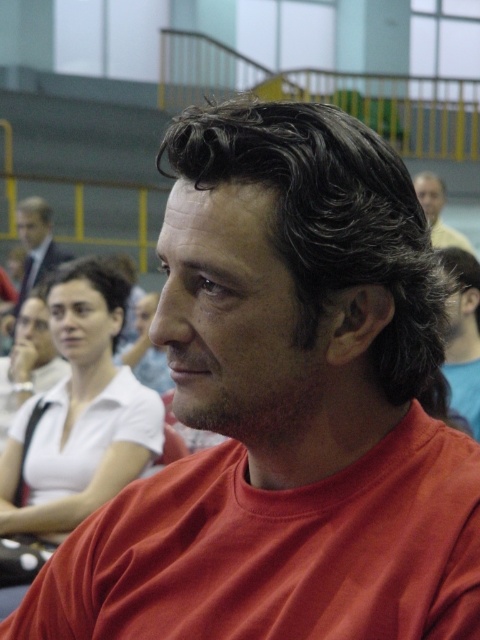
Is matte red shirt at center further to camera compared to matte black suit at upper left?

No, it is not.

Does matte red shirt at center appear under matte black suit at upper left?

Yes, matte red shirt at center is below matte black suit at upper left.

The image size is (480, 640). Describe the element at coordinates (463, 333) in the screenshot. I see `matte red shirt at center` at that location.

Locate an element on the screen. matte red shirt at center is located at coordinates (463, 333).

Can you confirm if white matte shirt at center is positioned above matte black hair at upper center?

No.

Is point (159, 400) farther from camera compared to point (444, 188)?

No, it is not.

The height and width of the screenshot is (640, 480). What are the coordinates of `white matte shirt at center` in the screenshot? It's located at (81, 412).

You are a GUI agent. You are given a task and a screenshot of the screen. Output one action in this format:
    pyautogui.click(x=<x>, y=<y>)
    Task: Click on the white matte shirt at center
    The width and height of the screenshot is (480, 640).
    Given the screenshot: What is the action you would take?
    pyautogui.click(x=81, y=412)

Does matte red shirt at center have a lesser width compared to matte black hair at upper center?

Correct, matte red shirt at center's width is less than matte black hair at upper center's.

Between matte red shirt at center and matte black hair at upper center, which one appears on the right side from the viewer's perspective?

matte black hair at upper center

What do you see at coordinates (463, 333) in the screenshot?
I see `matte red shirt at center` at bounding box center [463, 333].

At what (x,y) coordinates should I click in order to perform the action: click on matte red shirt at center. Please return your answer as a coordinate pair (x, y). Image resolution: width=480 pixels, height=640 pixels. Looking at the image, I should click on (463, 333).